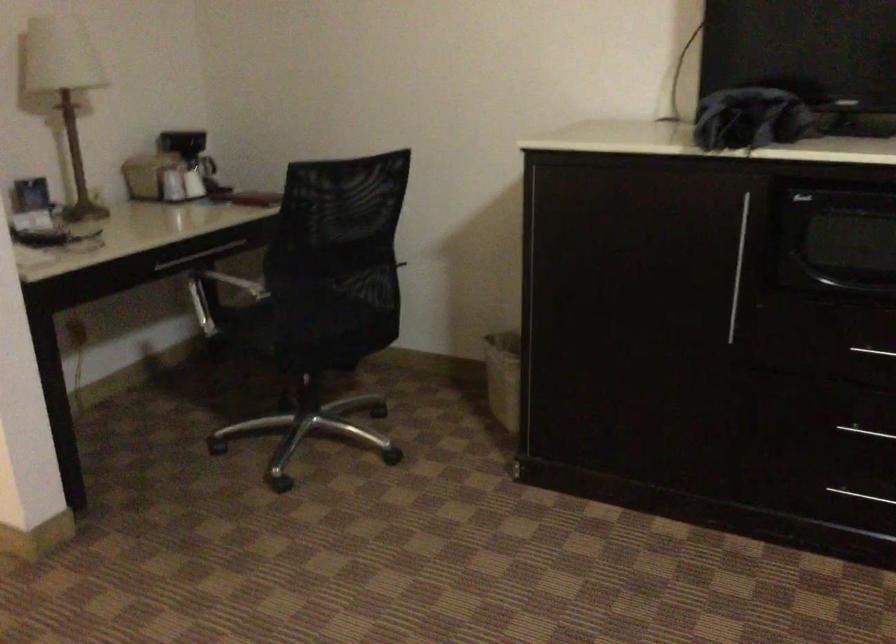
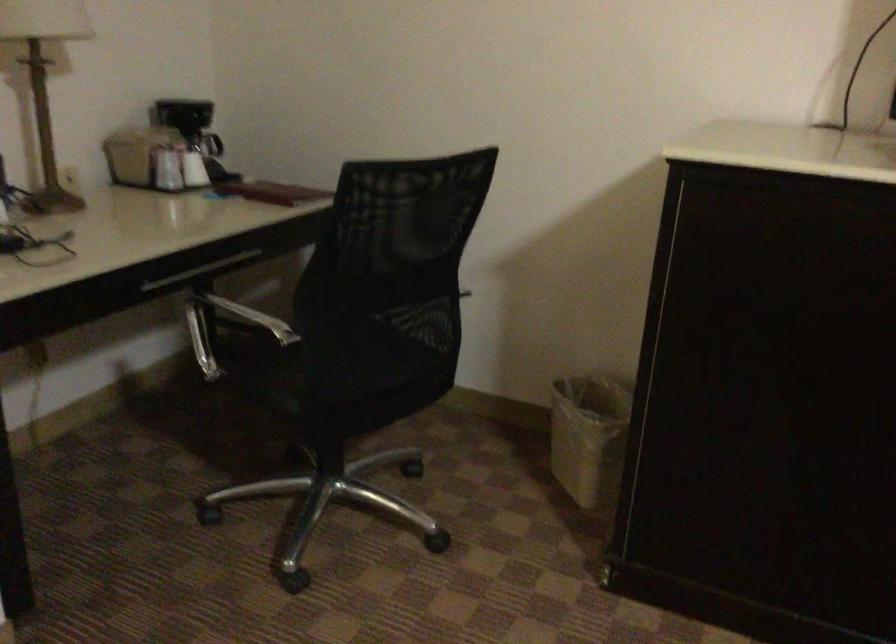
In the second image, find the point that corresponds to point 507,373 in the first image.

(589, 437)